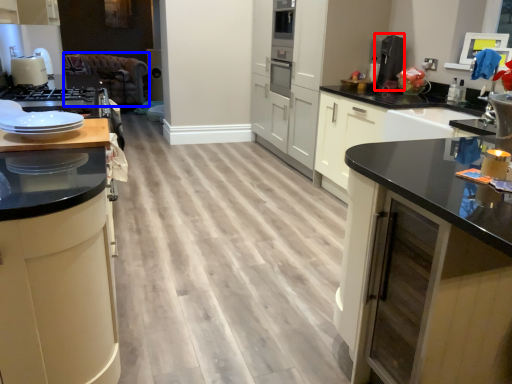
Question: Which object is closer to the camera taking this photo, coffee machine (highlighted by a red box) or brown (highlighted by a blue box)?

Choices:
 (A) coffee machine
 (B) brown

Answer: (A)